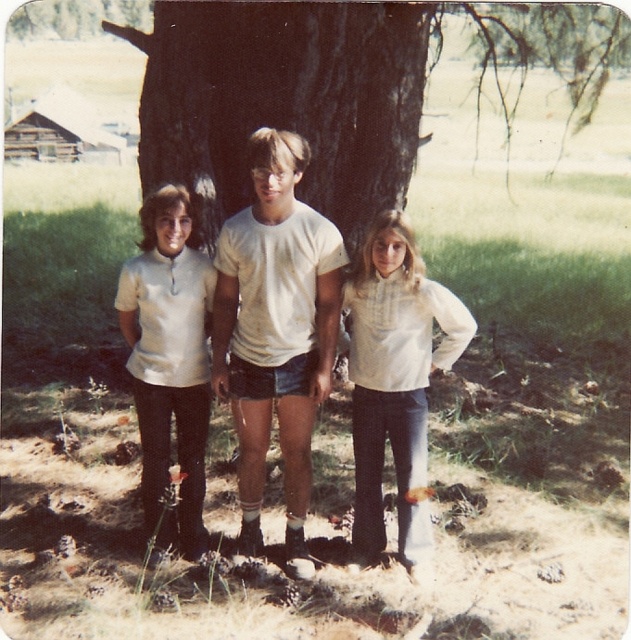
You are standing at the point marked as point (227, 330) in the image. You want to walk straight towards the large tree trunk in the background. How far will you have to walk to reach the tree trunk?

The point marked as point (227, 330) is 4.35 meters away from the viewer. Since the tree trunk is in the background, you would need to walk 4.35 meters to reach it.

You are standing in a rural area with three people near a large tree trunk. You need to locate a specific point at coordinates (274, 332). Which object is this point located on?

The point at coordinates (274, 332) is located on the white cotton t shirt at center.

You are standing in a rural area with three people near a large tree trunk. You need to locate the white cotton shirt at center. Which direction should you look relative to the large tree trunk?

The white cotton shirt at center is located at point (396, 380). Since the tree trunk is the central reference point, you should look towards the center area near the tree trunk to find the white cotton shirt at center.